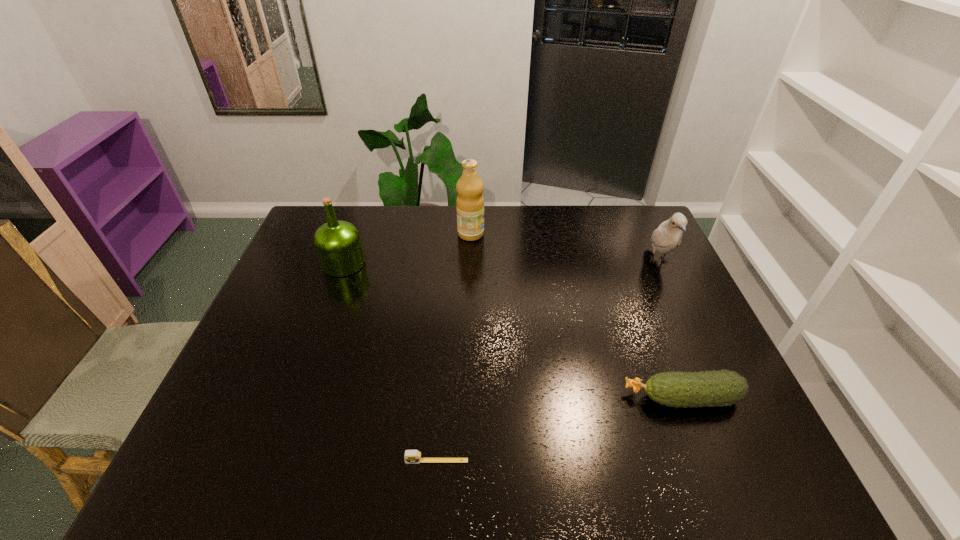
This screenshot has height=540, width=960. Find the location of `empty location between the nearer olive oil and the right olive oil`. empty location between the nearer olive oil and the right olive oil is located at coordinates (407, 249).

Where is `unoccupied area between the left olive oil and the second nearest object`? The width and height of the screenshot is (960, 540). unoccupied area between the left olive oil and the second nearest object is located at coordinates (513, 330).

Where is `vacant space that's between the fourth farthest object and the bird`? The height and width of the screenshot is (540, 960). vacant space that's between the fourth farthest object and the bird is located at coordinates (670, 329).

The image size is (960, 540). I want to click on blank region between the nearest object and the left olive oil, so click(x=390, y=362).

In order to click on empty space between the leftmost object and the farthest object in this screenshot , I will do `click(407, 249)`.

Find the location of a particular element. free point between the farthest object and the shortest object is located at coordinates (454, 347).

Locate an element on the screen. free space between the bird and the shortest object is located at coordinates (547, 361).

Identify the location of the second closest object to the tape measure. This screenshot has width=960, height=540. click(x=338, y=245).

Find the location of a particular element. The image size is (960, 540). object that is the fourth nearest to the nearest object is located at coordinates (668, 235).

Find the location of a particular element. Image resolution: width=960 pixels, height=540 pixels. free location that satisfies the following two spatial constraints: 1. at the blossom end of the cucumber; 2. at the front of the nearest object with the tape extended is located at coordinates (707, 461).